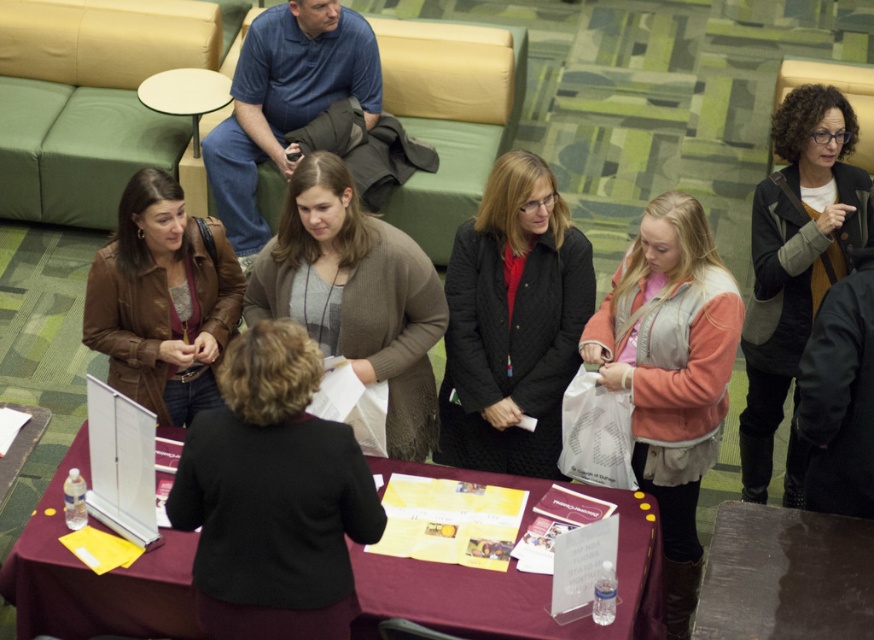
You are organizing a coat rack for an event and need to place the quilted black jacket at center and the light pink fleece vest at center. If the coat rack has a limited space, which item requires more space due to its size?

The quilted black jacket at center requires more space because it is bigger than the light pink fleece vest at center.

You are standing at the point labeled as point (170,177) and want to move towards the table in the scene. Is the point labeled point (528,589) located in front of you or behind you?

Point (528,589) is in front of point (170,177), so it is located in front of you.

You are organizing a small event and need to place a new decorative item on the table. Given the current setup with the maroon fabric table at center and the quilted black jacket at center, which object should you avoid placing the item on?

You should avoid placing the item on the maroon fabric table at center because it is smaller than the quilted black jacket at center, indicating limited space.